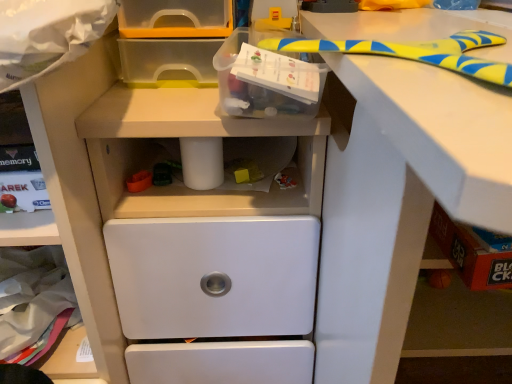
Locate an element on the screen. This screenshot has width=512, height=384. free location above white plastic workbench at center (from a real-world perspective) is located at coordinates (174, 92).